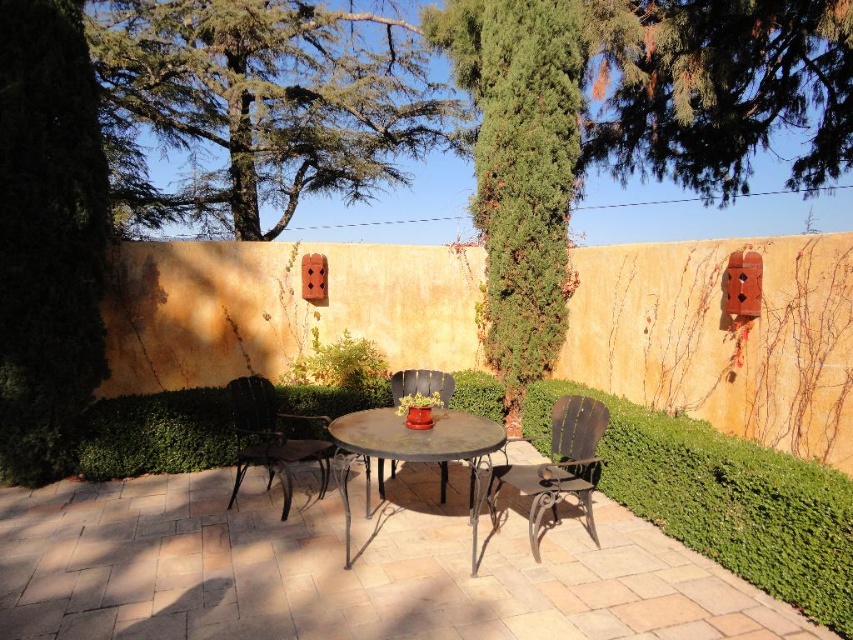
Question: Observing the image, what is the correct spatial positioning of green textured tree at center in reference to metallic dark brown chair at left?

Choices:
 (A) below
 (B) above

Answer: (B)

Question: Which of the following is the closest to the observer?

Choices:
 (A) dark brown wrought iron chair at center
 (B) metallic dark brown chair at center

Answer: (A)

Question: Which of the following is the closest to the observer?

Choices:
 (A) green leafy tree at left
 (B) dark brown wrought iron chair at center
 (C) green leafy tree at upper center
 (D) metallic dark brown chair at center

Answer: (B)

Question: Which object is farther from the camera taking this photo?

Choices:
 (A) metallic dark brown chair at center
 (B) green leafy tree at left
 (C) green textured tree at center

Answer: (C)

Question: Can you confirm if green textured tree at center is positioned below rusty metal table at center?

Choices:
 (A) no
 (B) yes

Answer: (A)

Question: Is dark brown wrought iron chair at center positioned in front of rusty metal table at center?

Choices:
 (A) no
 (B) yes

Answer: (A)